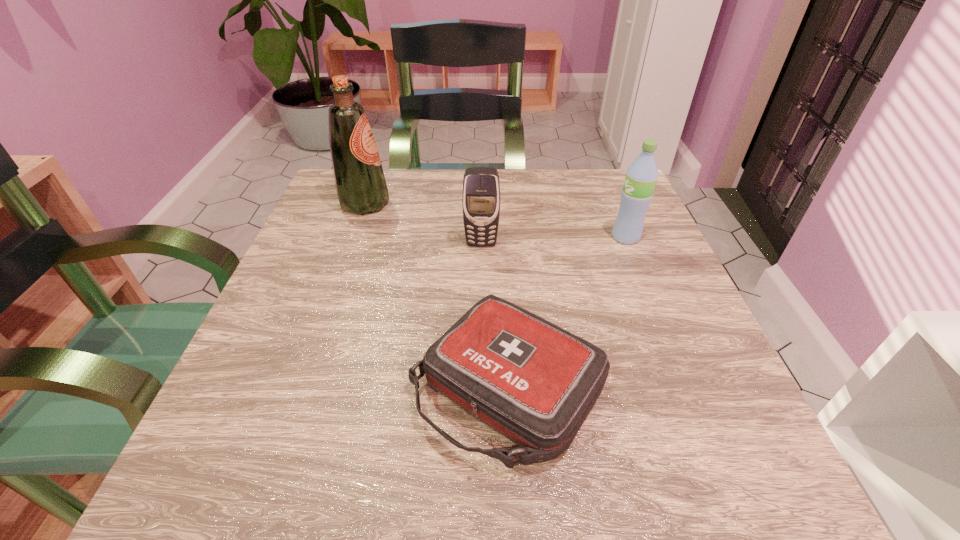
The image size is (960, 540). I want to click on vacant space located 0.250m on the back of the first-aid kit, so click(499, 234).

The image size is (960, 540). Find the location of `object that is at the far edge`. object that is at the far edge is located at coordinates (361, 188).

Where is `object that is at the near edge`? The width and height of the screenshot is (960, 540). object that is at the near edge is located at coordinates (533, 382).

Find the location of `object at the left edge`. object at the left edge is located at coordinates (361, 188).

You are a GUI agent. You are given a task and a screenshot of the screen. Output one action in this format:
    pyautogui.click(x=<x>, y=<y>)
    Task: Click on the object at the right edge
    Image resolution: width=960 pixels, height=540 pixels.
    Given the screenshot: What is the action you would take?
    pyautogui.click(x=641, y=177)

The width and height of the screenshot is (960, 540). What are the coordinates of `object that is at the far left corner` in the screenshot? It's located at (361, 188).

This screenshot has height=540, width=960. I want to click on vacant area at the far edge of the desktop, so (x=528, y=224).

In order to click on vacant area at the left edge of the desktop in this screenshot , I will do `click(289, 314)`.

Identify the location of vacant region at the right edge of the desktop. This screenshot has width=960, height=540. (710, 396).

The image size is (960, 540). What are the coordinates of `vacant space at the far left corner of the desktop` in the screenshot? It's located at (339, 203).